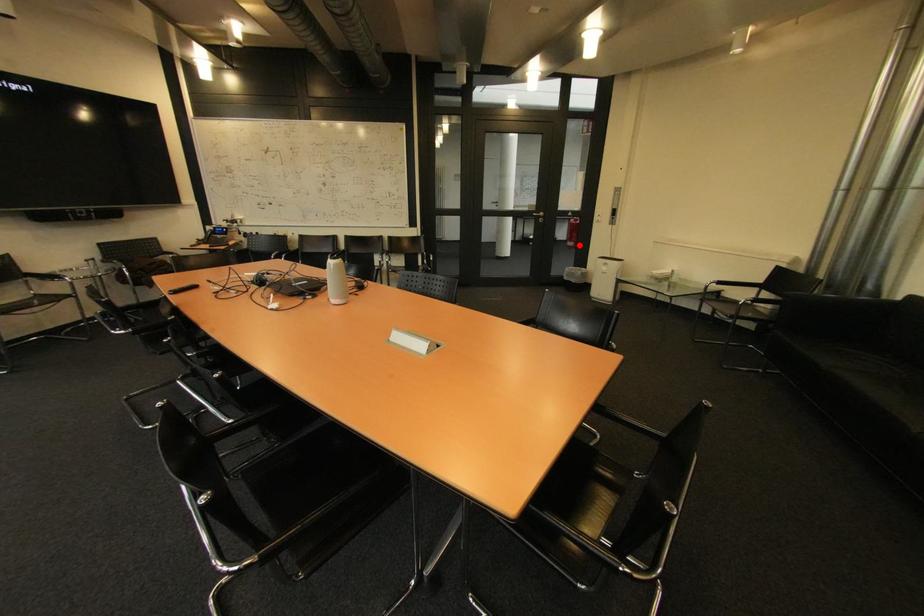
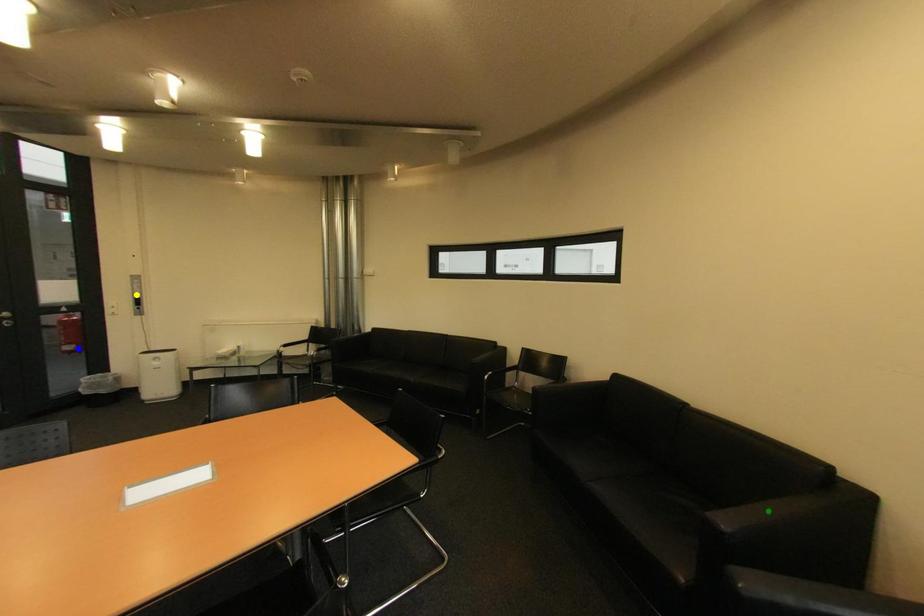
Question: I am providing you with two images of the same scene from different viewpoints. A red point is marked on the first image. You are given multiple points on the second image. Which point in image 2 represents the same 3d spot as the red point in image 1?

Choices:
 (A) blue point
 (B) yellow point
 (C) green point

Answer: (A)